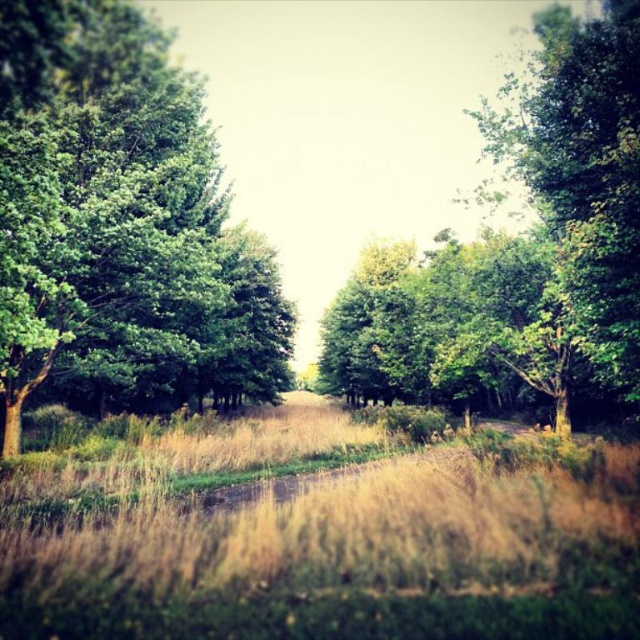
Between dry grass at center and green leafy tree at center, which one appears on the left side from the viewer's perspective?

dry grass at center

Which is behind, point (292, 547) or point (625, 228)?

Point (625, 228)

Is point (536, 618) more distant than point (348, 387)?

No, (536, 618) is in front of (348, 387).

Identify the location of dry grass at center. (323, 538).

Is green leafy tree at left smaller than green leafy tree at center?

Yes.

How distant is green leafy tree at left from green leafy tree at center?

A distance of 11.61 meters exists between green leafy tree at left and green leafy tree at center.

Which is in front, point (136, 262) or point (456, 344)?

Point (136, 262)

Where is `green leafy tree at left`? green leafy tree at left is located at coordinates (120, 227).

Who is lower down, dry grass at center or green leafy tree at left?

dry grass at center is lower down.

Is dry grass at center positioned at the back of green leafy tree at left?

No, dry grass at center is closer to the viewer.

Locate an element on the screen. The height and width of the screenshot is (640, 640). dry grass at center is located at coordinates (323, 538).